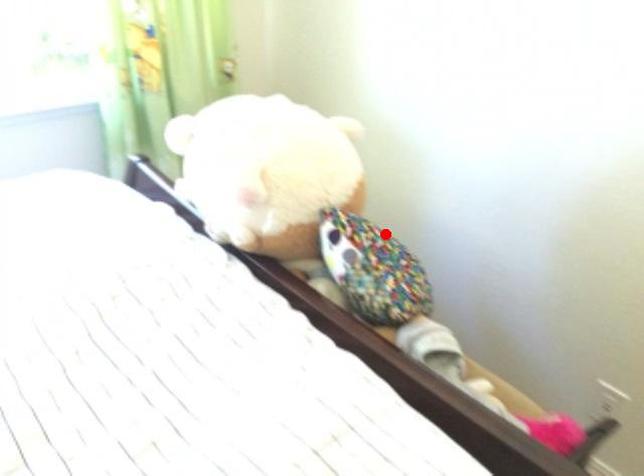
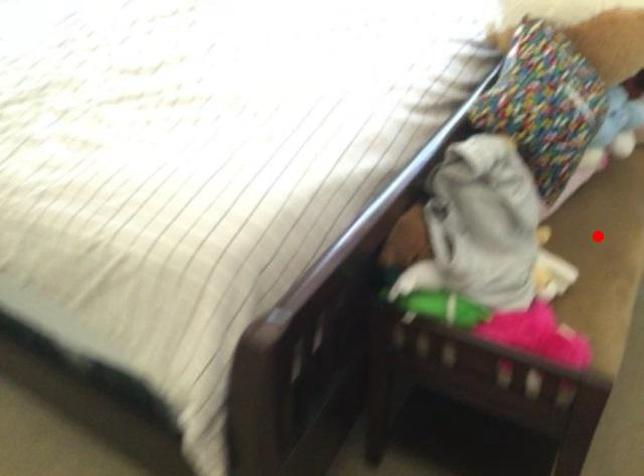
I am providing you with two images of the same scene from different viewpoints. A red point is marked on the first image and another point is marked on the second image. Is the red point in image1 aligned with the point shown in image2?

No